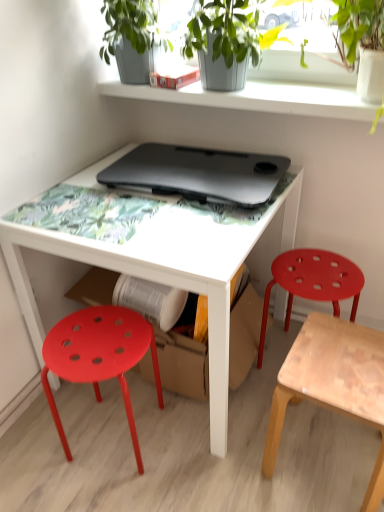
What are the coordinates of `empty space that is ontop of white glossy table at center (from a real-world perspective)` in the screenshot? It's located at (139, 210).